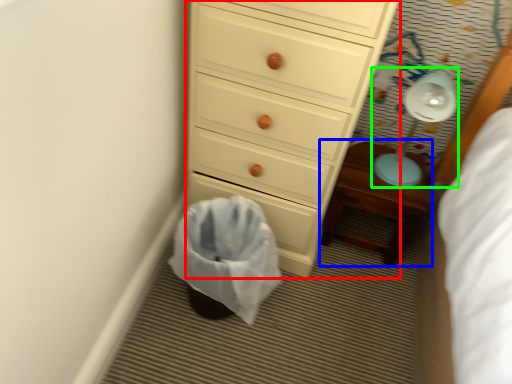
Question: Estimate the real-world distances between objects in this image. Which object is closer to chest of drawers (highlighted by a red box), nightstand (highlighted by a blue box) or lamp (highlighted by a green box)?

Choices:
 (A) nightstand
 (B) lamp

Answer: (A)